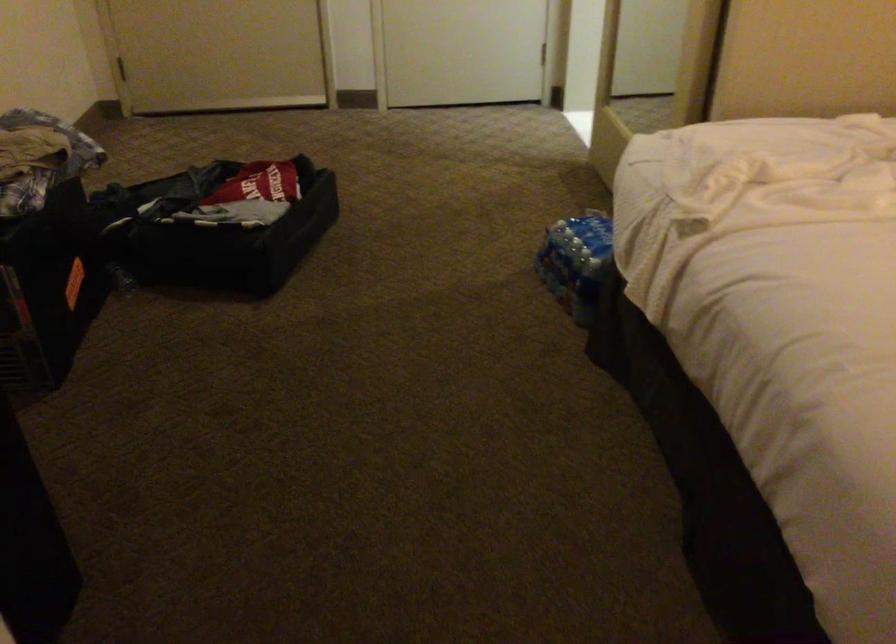
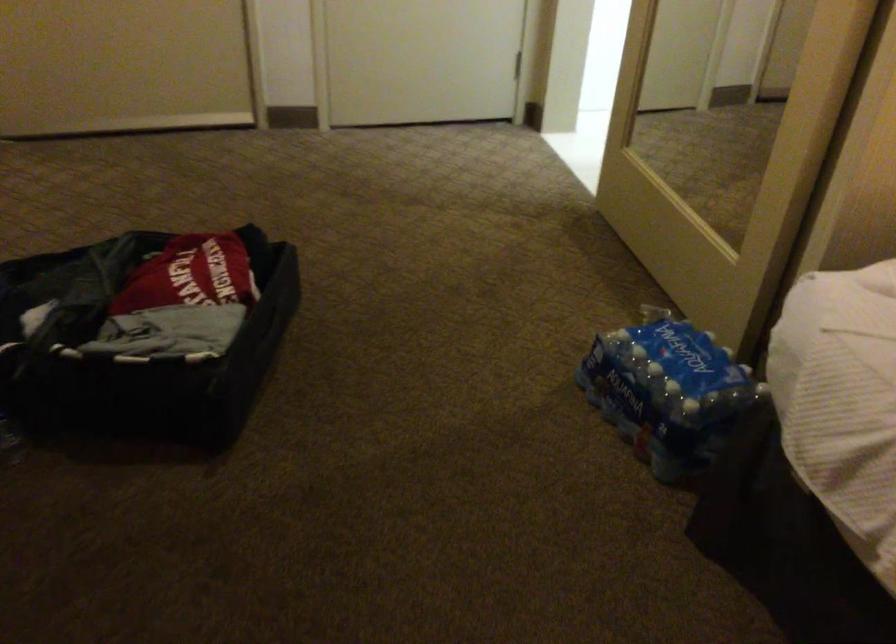
Question: The first image is from the beginning of the video and the second image is from the end. How did the camera likely rotate when shooting the video?

Choices:
 (A) Left
 (B) Right
 (C) Up
 (D) Down

Answer: (B)